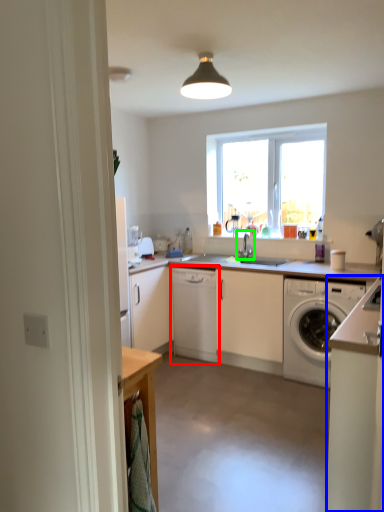
Question: Considering the real-world distances, which object is farthest from cabinetry (highlighted by a red box)? cabinetry (highlighted by a blue box) or tap (highlighted by a green box)?

Choices:
 (A) cabinetry
 (B) tap

Answer: (A)